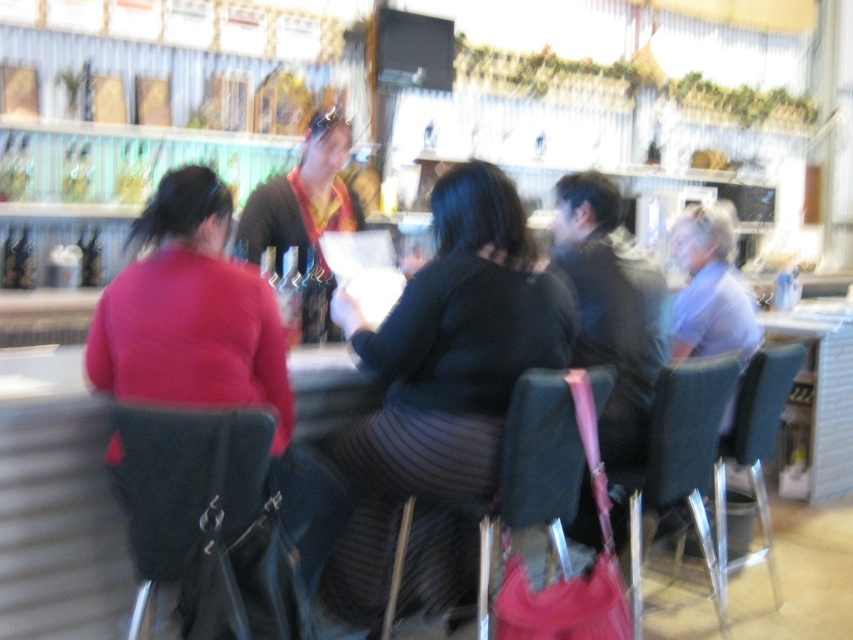
Question: Which point is farther to the camera?

Choices:
 (A) teal fabric chair at right
 (B) matte red sweater at left

Answer: (A)

Question: Which point is closer to the camera?

Choices:
 (A) black fabric chair at center
 (B) black textured sweater at center

Answer: (A)

Question: Is black leather chair at left above teal fabric chair at right?

Choices:
 (A) no
 (B) yes

Answer: (B)

Question: Is matte red sweater at left further to camera compared to teal fabric chair at right?

Choices:
 (A) no
 (B) yes

Answer: (A)

Question: Which of the following is the farthest from the observer?

Choices:
 (A) (408, 330)
 (B) (529, 480)
 (C) (726, 525)
 (D) (194, 609)

Answer: (C)

Question: Is matte red sweater at left thinner than teal fabric chair at right?

Choices:
 (A) yes
 (B) no

Answer: (B)